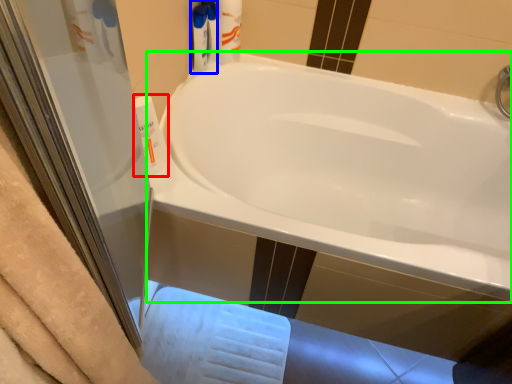
Question: Based on their relative distances, which object is nearer to cleaning product (highlighted by a red box)? Choose from cleaning product (highlighted by a blue box) and bathtub (highlighted by a green box).

Choices:
 (A) cleaning product
 (B) bathtub

Answer: (A)